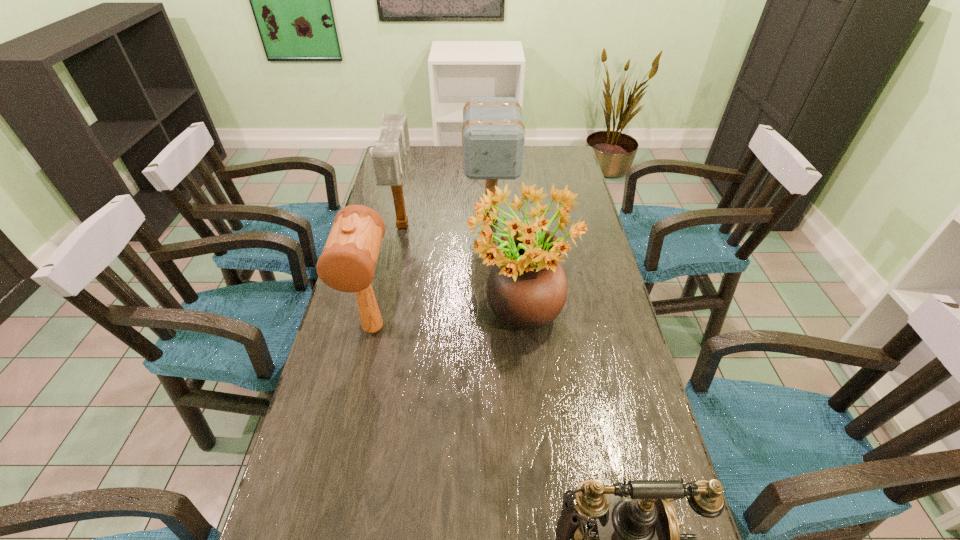
Find the location of a particular element. This screenshot has height=540, width=960. the rightmost mallet is located at coordinates (493, 135).

I want to click on flower arrangement, so click(x=527, y=288).

At what (x,y) coordinates should I click in order to perform the action: click on the nearest mallet. Please return your answer as a coordinate pair (x, y). Looking at the image, I should click on tap(347, 263).

At what (x,y) coordinates should I click in order to perform the action: click on vacant space located on the striking surface of the rightmost mallet. Please return your answer as a coordinate pair (x, y). The height and width of the screenshot is (540, 960). Looking at the image, I should click on (493, 292).

I want to click on vacant space located 0.110m on the right of the flower arrangement, so click(609, 321).

Image resolution: width=960 pixels, height=540 pixels. Identify the location of vacant space located on the strike surface of the nearest mallet. (347, 450).

At what (x,y) coordinates should I click in order to perform the action: click on object at the right edge. Please return your answer as a coordinate pair (x, y). The image size is (960, 540). Looking at the image, I should click on (527, 288).

Where is `vacant space at the far edge of the desktop`? The height and width of the screenshot is (540, 960). vacant space at the far edge of the desktop is located at coordinates (443, 164).

Identify the location of vacant region at the left edge. (312, 488).

What are the coordinates of `vacant space at the right edge of the desktop` in the screenshot? It's located at (641, 464).